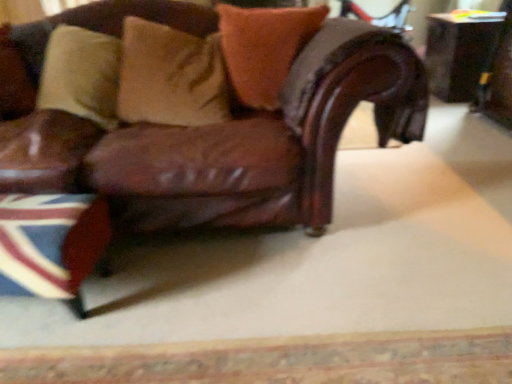
Where is `empty space that is in between brown leather chair at center and union jack fabric at lower left`? Image resolution: width=512 pixels, height=384 pixels. empty space that is in between brown leather chair at center and union jack fabric at lower left is located at coordinates (203, 288).